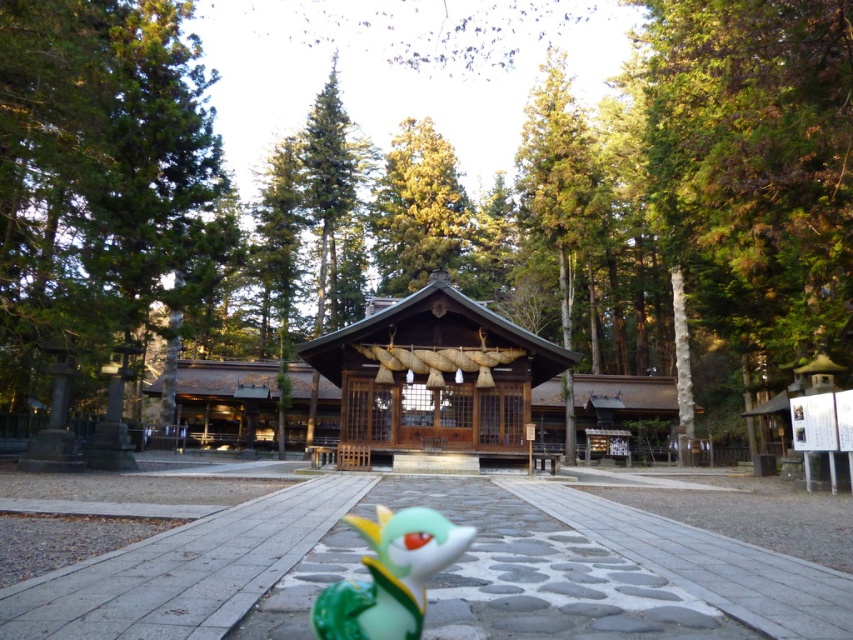
Question: Does green leafy tree at center appear under green textured tree at left?

Choices:
 (A) no
 (B) yes

Answer: (A)

Question: Observing the image, what is the correct spatial positioning of green leafy tree at center in reference to green glossy toy at lower center?

Choices:
 (A) right
 (B) left

Answer: (B)

Question: Which of the following is the farthest from the observer?

Choices:
 (A) (570, 401)
 (B) (796, 99)
 (C) (323, 598)

Answer: (A)

Question: Which object is positioned farthest from the green textured tree at left?

Choices:
 (A) green glossy toy at lower center
 (B) green leafy tree at center
 (C) green textured tree at upper center

Answer: (C)

Question: Which object is positioned farthest from the green textured tree at upper center?

Choices:
 (A) green textured tree at left
 (B) green glossy toy at lower center

Answer: (B)

Question: Is green textured tree at left to the left of green glossy toy at lower center from the viewer's perspective?

Choices:
 (A) no
 (B) yes

Answer: (B)